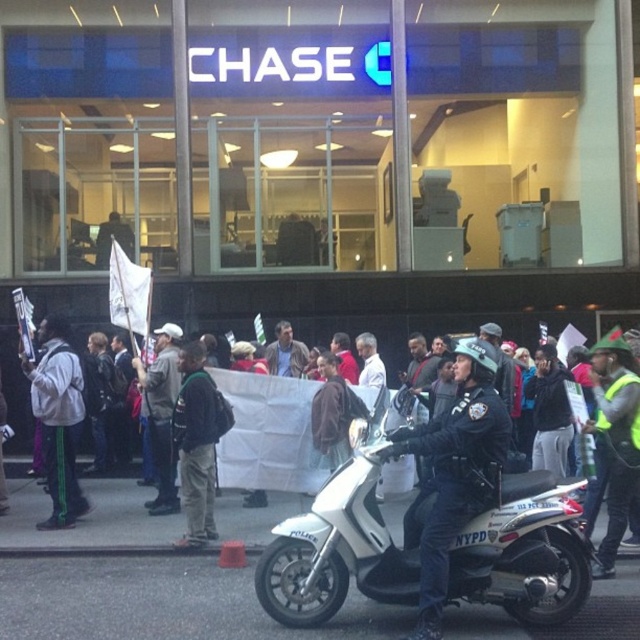
You are a journalist trying to capture the protest scene. You notice the white fabric banner at center and the brown leather jacket at center. Which object is positioned to the left when viewed from your perspective?

The white fabric banner at center is to the left of the brown leather jacket at center.

You are a protest organizer standing at the front of the crowd facing the Chase bank entrance. You want to ensure your white fabric banner at center is visible to everyone in the crowd. Considering the banner is 29.99 feet away from you, what should you do to make sure it can be seen by those further back?

The white fabric banner at center is 29.99 feet from the viewer. To ensure visibility for those further back, you should raise the banner higher or move it to a more elevated position so that it can be seen over the crowd.

You are a pedestrian standing at the entrance of the Chase bank. There is a point marked at coordinates [452,472]. Which object is this point located on?

The point at coordinates [452,472] is located on the black leather helmet at center.